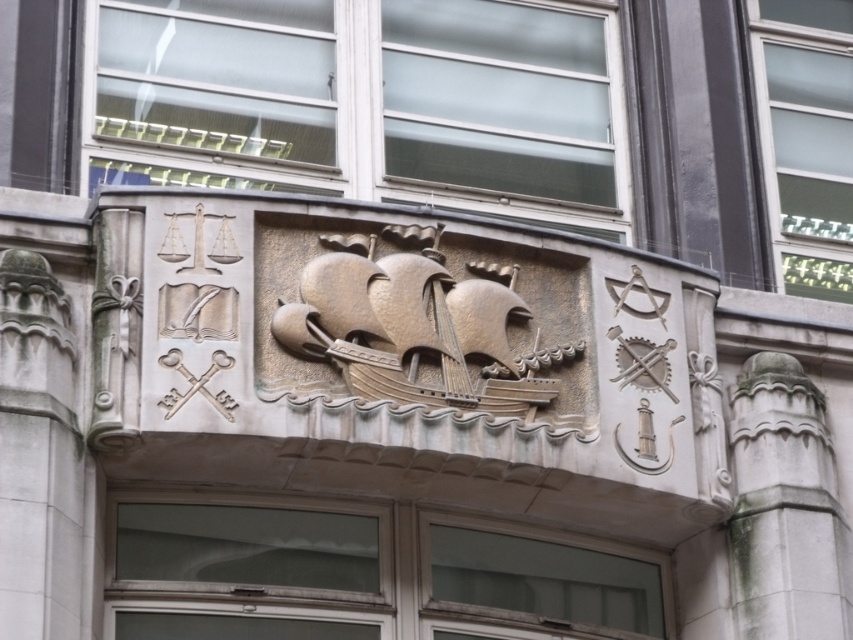
Question: Is smooth glass door at center further to camera compared to white stone column at center?

Choices:
 (A) yes
 (B) no

Answer: (B)

Question: Which point is farther to the camera?

Choices:
 (A) (399, 512)
 (B) (764, 372)

Answer: (B)

Question: Considering the relative positions of smooth glass door at center and white stone column at center in the image provided, where is smooth glass door at center located with respect to white stone column at center?

Choices:
 (A) left
 (B) right

Answer: (A)

Question: From the image, what is the correct spatial relationship of smooth glass door at center in relation to white stone column at center?

Choices:
 (A) above
 (B) below

Answer: (B)